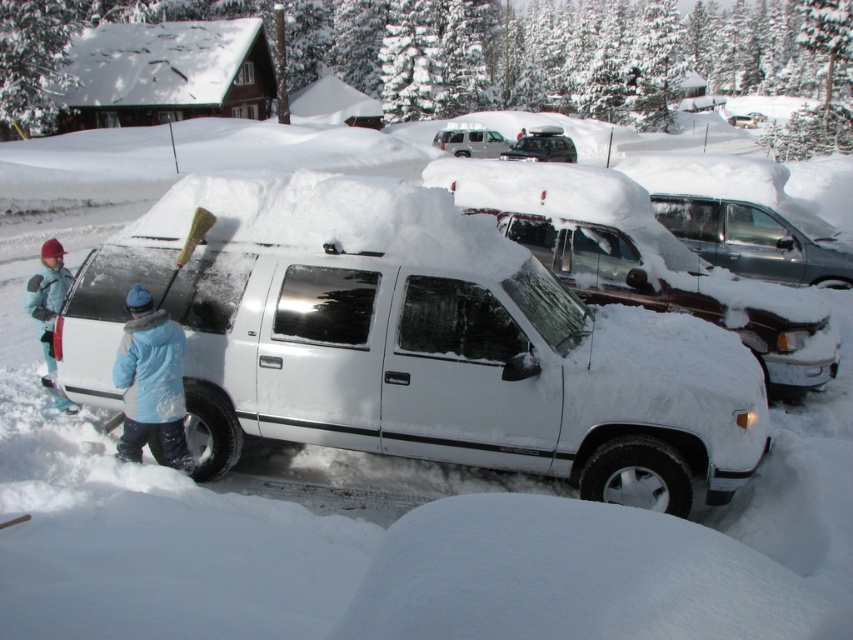
Question: Can you confirm if white matte truck at center is smaller than metallic gray minivan at center?

Choices:
 (A) yes
 (B) no

Answer: (B)

Question: Is white matte truck at center thinner than light blue jacket at left?

Choices:
 (A) no
 (B) yes

Answer: (A)

Question: Among these objects, which one is farthest from the camera?

Choices:
 (A) white matte truck at center
 (B) blue fuzzy jacket at lower left

Answer: (B)

Question: Which object is farther from the camera taking this photo?

Choices:
 (A) matte black suv at center
 (B) blue fuzzy jacket at lower left

Answer: (A)

Question: Which of these objects is positioned farthest from the silver metallic suv at upper center?

Choices:
 (A) blue fuzzy jacket at lower left
 (B) light blue jacket at left
 (C) white matte truck at center

Answer: (A)

Question: Is metallic gray minivan at center wider than silver metallic suv at upper center?

Choices:
 (A) yes
 (B) no

Answer: (B)